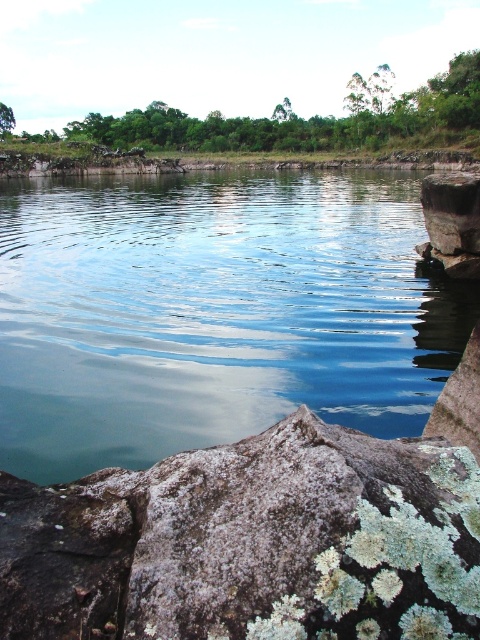
Question: Is clear water at center closer to the viewer compared to white lichen-covered rock at lower right?

Choices:
 (A) yes
 (B) no

Answer: (B)

Question: Can you confirm if clear water at center is thinner than white lichen-covered rock at lower right?

Choices:
 (A) no
 (B) yes

Answer: (A)

Question: Which object appears closest to the camera in this image?

Choices:
 (A) white lichen-covered rock at lower right
 (B) clear water at center

Answer: (A)

Question: Is clear water at center to the right of white lichen-covered rock at lower right from the viewer's perspective?

Choices:
 (A) yes
 (B) no

Answer: (B)

Question: Which point is closer to the camera?

Choices:
 (A) white lichen-covered rock at lower right
 (B) clear water at center

Answer: (A)